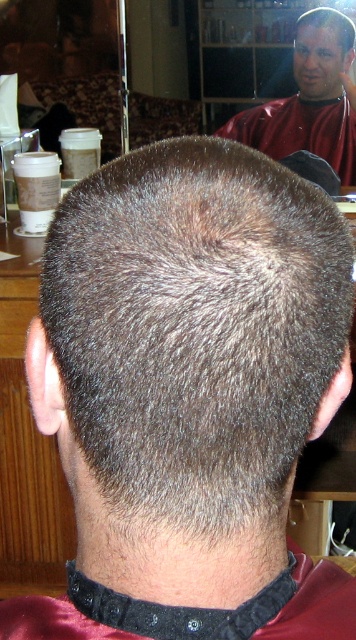
Question: Can you confirm if smooth red barber at upper right is thinner than dark gray hair at center?

Choices:
 (A) yes
 (B) no

Answer: (B)

Question: Where is smooth red barber at upper right located in relation to dark gray hair at center in the image?

Choices:
 (A) left
 (B) right

Answer: (A)

Question: Can you confirm if smooth red barber at upper right is positioned above dark gray hair at center?

Choices:
 (A) no
 (B) yes

Answer: (A)

Question: Which point appears farthest from the camera in this image?

Choices:
 (A) (289, 106)
 (B) (325, 26)
 (C) (116, 221)

Answer: (A)

Question: Which of these objects is positioned closest to the dark brown hair at center?

Choices:
 (A) dark gray hair at center
 (B) smooth red barber at upper right

Answer: (B)

Question: Which point appears closest to the camera in this image?

Choices:
 (A) (317, 83)
 (B) (85, 273)
 (C) (342, 33)

Answer: (B)